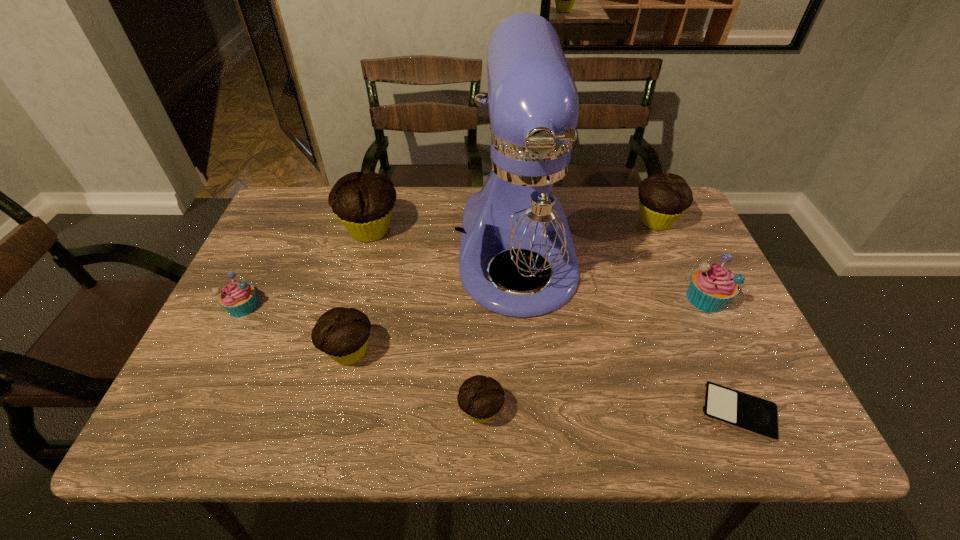
At what (x,y) coordinates should I click in order to perform the action: click on free space at the far edge of the desktop. Please return your answer as a coordinate pair (x, y). The width and height of the screenshot is (960, 540). Looking at the image, I should click on (442, 234).

You are a GUI agent. You are given a task and a screenshot of the screen. Output one action in this format:
    pyautogui.click(x=<x>, y=<y>)
    Task: Click on the free region at the near edge of the desktop
    The image size is (960, 540).
    Given the screenshot: What is the action you would take?
    pyautogui.click(x=261, y=426)

Image resolution: width=960 pixels, height=540 pixels. In order to click on free location at the right edge of the desktop in this screenshot , I will do `click(672, 257)`.

Find the location of a particular element. This screenshot has width=960, height=540. vacant space at the far right corner of the desktop is located at coordinates (636, 191).

What are the coordinates of `vacant area that lies between the mixer and the third biggest chocolate muffin` in the screenshot? It's located at [433, 302].

This screenshot has height=540, width=960. Identify the location of vacant area that lies between the smaller blue muffin and the rightmost chocolate muffin. (449, 264).

The width and height of the screenshot is (960, 540). What are the coordinates of `vacant space in between the right blue muffin and the third tallest object` in the screenshot? It's located at (681, 260).

What are the coordinates of `free space between the seventh shortest object and the gray iPod` in the screenshot? It's located at (554, 321).

The width and height of the screenshot is (960, 540). I want to click on empty space between the smaller blue muffin and the seventh shortest object, so click(x=306, y=268).

This screenshot has height=540, width=960. What are the coordinates of `empty location between the second nearest muffin and the smaller blue muffin` in the screenshot? It's located at (296, 329).